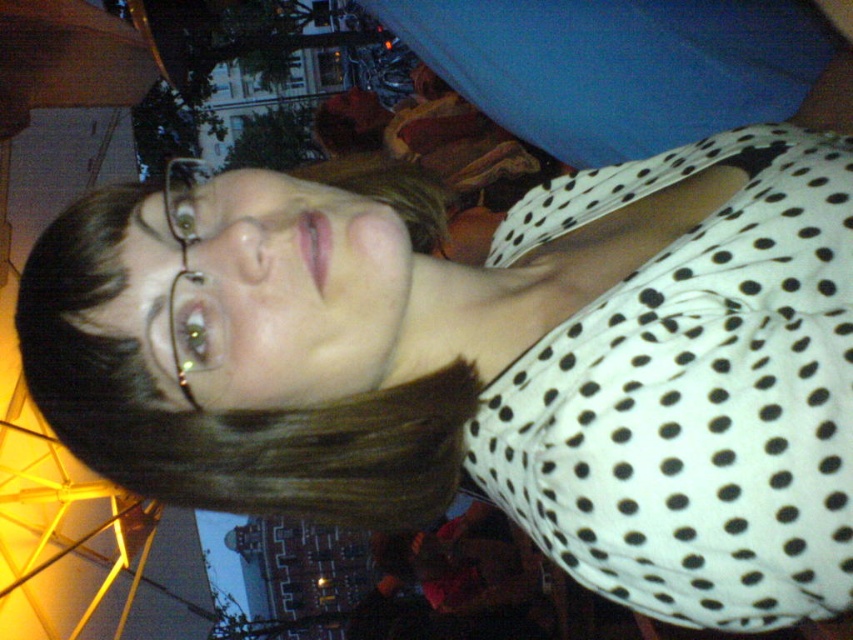
From the picture: Can you confirm if white dotted fabric at center is bigger than brown smooth hair at upper left?

Correct, white dotted fabric at center is larger in size than brown smooth hair at upper left.

Which is below, white dotted fabric at center or brown smooth hair at upper left?

white dotted fabric at center

Locate an element on the screen. Image resolution: width=853 pixels, height=640 pixels. white dotted fabric at center is located at coordinates (692, 394).

Looking at this image, is white dotted fabric at center bigger than clear plastic glasses at upper left?

Indeed, white dotted fabric at center has a larger size compared to clear plastic glasses at upper left.

Is point (672, 157) farther from camera compared to point (189, 225)?

Yes, it is behind point (189, 225).

Between point (753, 472) and point (201, 168), which one is positioned behind?

The point (201, 168) is more distant.

The width and height of the screenshot is (853, 640). Identify the location of white dotted fabric at center. (692, 394).

Which is behind, point (106, 234) or point (204, 344)?

Positioned behind is point (106, 234).

Does brown smooth hair at upper left have a greater height compared to clear plastic glasses at upper left?

Indeed, brown smooth hair at upper left has a greater height compared to clear plastic glasses at upper left.

Image resolution: width=853 pixels, height=640 pixels. Identify the location of brown smooth hair at upper left. (221, 413).

I want to click on brown smooth hair at upper left, so click(x=221, y=413).